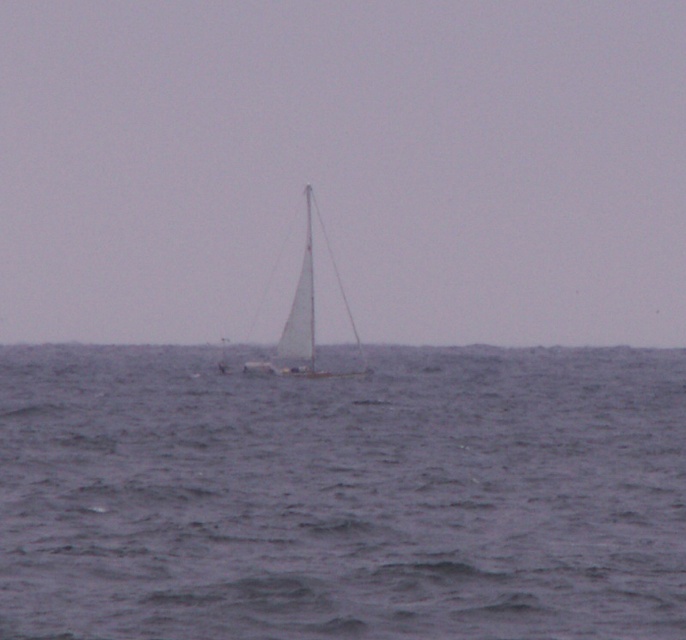
Question: Is gray water at center smaller than white sailboat at center?

Choices:
 (A) no
 (B) yes

Answer: (A)

Question: Among these objects, which one is nearest to the camera?

Choices:
 (A) white sailboat at center
 (B) gray water at center

Answer: (B)

Question: Is gray water at center smaller than white sailboat at center?

Choices:
 (A) no
 (B) yes

Answer: (A)

Question: Is gray water at center wider than white sailboat at center?

Choices:
 (A) no
 (B) yes

Answer: (B)